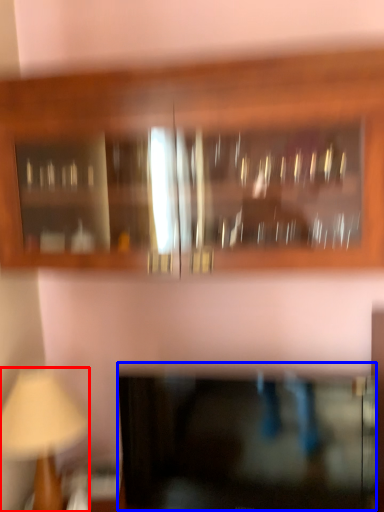
Question: Among these objects, which one is nearest to the camera, table lamp (highlighted by a red box) or cabinetry (highlighted by a blue box)?

Choices:
 (A) table lamp
 (B) cabinetry

Answer: (B)